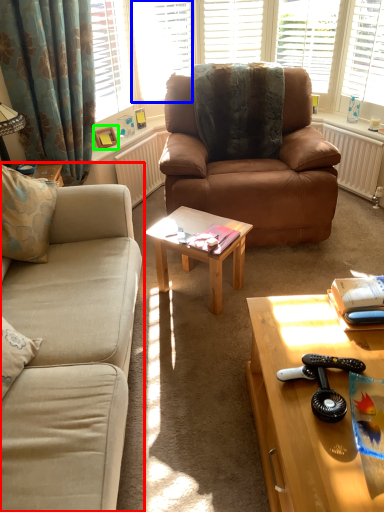
Question: Which object is the closest to the studio couch (highlighted by a red box)? Choose among these: window (highlighted by a blue box) or picture frame (highlighted by a green box).

Choices:
 (A) window
 (B) picture frame

Answer: (B)